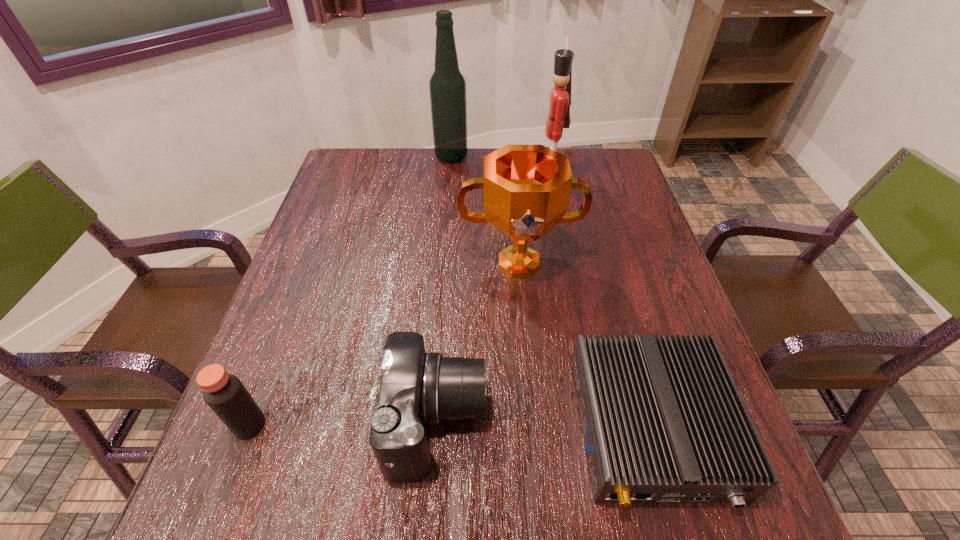
Identify the location of object present at the near right corner. (663, 421).

Find the location of `free spot at the far edge of the desktop`. free spot at the far edge of the desktop is located at coordinates (409, 168).

Where is `vacant space at the near edge`? vacant space at the near edge is located at coordinates (413, 517).

The image size is (960, 540). Find the location of `vacant point at the left edge`. vacant point at the left edge is located at coordinates (279, 445).

The height and width of the screenshot is (540, 960). I want to click on free location at the right edge of the desktop, so click(615, 323).

In order to click on free space at the far left corner of the desktop in this screenshot , I will do `click(390, 162)`.

The width and height of the screenshot is (960, 540). Identify the location of vacant space at the near left corner of the desktop. (210, 519).

This screenshot has width=960, height=540. What are the coordinates of `vacant area that lies between the camera and the vinegar` in the screenshot? It's located at (343, 423).

The height and width of the screenshot is (540, 960). Find the location of `free space between the camera and the fifth nearest object`. free space between the camera and the fifth nearest object is located at coordinates (493, 301).

Image resolution: width=960 pixels, height=540 pixels. I want to click on unoccupied position between the farthest object and the vinegar, so click(350, 291).